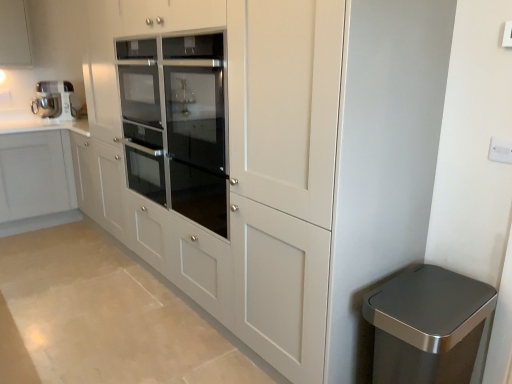
Question: From a real-world perspective, is satin silver trash can at lower right positioned above or below white plastic electric outlet at upper right?

Choices:
 (A) above
 (B) below

Answer: (B)

Question: Looking at their shapes, would you say satin silver trash can at lower right is wider or thinner than white plastic electric outlet at upper right?

Choices:
 (A) thin
 (B) wide

Answer: (B)

Question: Which object is the farthest from the white plastic electric outlet at upper right?

Choices:
 (A) metallic silver mixer at upper left
 (B) satin silver trash can at lower right
 (C) matte white cabinet at upper left

Answer: (C)

Question: Based on their relative distances, which object is nearer to the white plastic electric outlet at upper right?

Choices:
 (A) matte white cabinet at upper left
 (B) satin silver trash can at lower right
 (C) metallic silver mixer at upper left

Answer: (B)